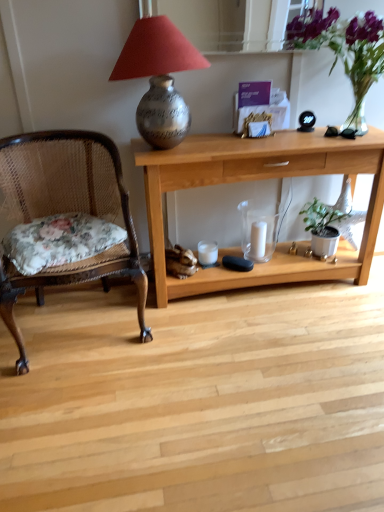
This screenshot has height=512, width=384. What do you see at coordinates (322, 227) in the screenshot?
I see `green matte plant at lower right` at bounding box center [322, 227].

Measure the distance between silver textured vase at upper center and camera.

The depth of silver textured vase at upper center is 4.97 feet.

What is the approximate height of transparent glass candle holder at center, the 1th candle holder in the right-to-left sequence?

transparent glass candle holder at center, the 1th candle holder in the right-to-left sequence, is 11.95 inches in height.

Measure the distance between point (48, 231) and camera.

Point (48, 231) and camera are 1.74 meters apart.

Identify the location of light wood desk at center. This screenshot has width=384, height=512. (257, 179).

Considering the positions of points (44, 204) and (261, 234), is point (44, 204) closer to camera compared to point (261, 234)?

That is True.

Is woven wood chair with floral cushion at left completely or partially outside of white matte candle at center?

woven wood chair with floral cushion at left lies outside white matte candle at center's area.

From the image's perspective, is woven wood chair with floral cushion at left located beneath white matte candle at center?

Yes, from the image's perspective, woven wood chair with floral cushion at left is below white matte candle at center.

Relative to white matte candle at center, is woven wood chair with floral cushion at left in front or behind?

Visually, woven wood chair with floral cushion at left is located in front of white matte candle at center.

Does green matte plant at lower right have a lesser height compared to white matte candle at center?

Incorrect, the height of green matte plant at lower right does not fall short of that of white matte candle at center.

Consider the image. Can you confirm if green matte plant at lower right is positioned to the right of white matte candle at center?

Indeed, green matte plant at lower right is positioned on the right side of white matte candle at center.

Considering the relative sizes of green matte plant at lower right and white matte candle at center in the image provided, is green matte plant at lower right bigger than white matte candle at center?

Yes, green matte plant at lower right is bigger than white matte candle at center.

Considering the relative sizes of white matte candle at center and transparent glass candle holder at center, the 1th candle holder in the right-to-left sequence, in the image provided, is white matte candle at center taller than transparent glass candle holder at center, the 1th candle holder in the right-to-left sequence,?

No, white matte candle at center is not taller than transparent glass candle holder at center, the 1th candle holder in the right-to-left sequence.

What's the angular difference between white matte candle at center and transparent glass candle holder at center, the 1th candle holder in the right-to-left sequence,'s facing directions?

They differ by 0.459 degrees in their facing directions.

Can you confirm if white matte candle at center is positioned to the left of transparent glass candle holder at center, which ranks as the 2th candle holder in left-to-right order?

In fact, white matte candle at center is to the right of transparent glass candle holder at center, which ranks as the 2th candle holder in left-to-right order.

From a real-world perspective, is white matte candle at center physically located above or below transparent glass candle holder at center, which ranks as the 2th candle holder in left-to-right order?

From a real-world perspective, white matte candle at center is physically below transparent glass candle holder at center, which ranks as the 2th candle holder in left-to-right order.

Which is in front, point (66, 184) or point (202, 149)?

The point (202, 149) is closer to the camera.

Is woven wood chair with floral cushion at left taller or shorter than light wood desk at center?

In the image, woven wood chair with floral cushion at left appears to be taller than light wood desk at center.

From a real-world perspective, who is located higher, woven wood chair with floral cushion at left or light wood desk at center?

From a 3D spatial view, woven wood chair with floral cushion at left is above.

Is white matte candle at center to the left or to the right of silver textured vase at upper center in the image?

white matte candle at center is positioned on silver textured vase at upper center's right side.

Is the depth of white matte candle at center less than that of silver textured vase at upper center?

No, white matte candle at center is further to the viewer.

Does white matte candle at center touch silver textured vase at upper center?

They are not placed beside each other.

Is white matte candle at center completely or partially outside of silver textured vase at upper center?

Indeed, white matte candle at center is completely outside silver textured vase at upper center.

Are transparent glass candle holder at center, which ranks as the 2th candle holder in left-to-right order, and white matte candle holder at center, which is counted as the 1th candle holder, starting from the left, beside each other?

There is a gap between transparent glass candle holder at center, which ranks as the 2th candle holder in left-to-right order, and white matte candle holder at center, which is counted as the 1th candle holder, starting from the left.

Which is more to the left, transparent glass candle holder at center, which ranks as the 2th candle holder in left-to-right order, or white matte candle holder at center, which appears as the 2th candle holder when viewed from the right?

Positioned to the left is white matte candle holder at center, which appears as the 2th candle holder when viewed from the right.

From a real-world perspective, which is physically below, transparent glass candle holder at center, which ranks as the 2th candle holder in left-to-right order, or white matte candle holder at center, which is counted as the 1th candle holder, starting from the left?

From a 3D spatial view, white matte candle holder at center, which is counted as the 1th candle holder, starting from the left, is below.

Is transparent glass candle holder at center, which ranks as the 2th candle holder in left-to-right order, bigger than white matte candle holder at center, which is counted as the 1th candle holder, starting from the left?

Correct, transparent glass candle holder at center, which ranks as the 2th candle holder in left-to-right order, is larger in size than white matte candle holder at center, which is counted as the 1th candle holder, starting from the left.

In the scene shown: Is purple glass vase at upper right taller than woven wood chair with floral cushion at left?

No.

Is the depth of purple glass vase at upper right less than that of woven wood chair with floral cushion at left?

No, purple glass vase at upper right is behind woven wood chair with floral cushion at left.

From the image's perspective, is purple glass vase at upper right on woven wood chair with floral cushion at left?

Indeed, from the image's perspective, purple glass vase at upper right is shown above woven wood chair with floral cushion at left.

Is purple glass vase at upper right facing away from woven wood chair with floral cushion at left?

purple glass vase at upper right is not turned away from woven wood chair with floral cushion at left.

Image resolution: width=384 pixels, height=512 pixels. What are the coordinates of `chair above the white matte candle at center (from a real-world perspective)` in the screenshot? It's located at (64, 220).

At what (x,y) coordinates should I click in order to perform the action: click on houseplant in front of the white matte candle at center. Please return your answer as a coordinate pair (x, y). Image resolution: width=384 pixels, height=512 pixels. Looking at the image, I should click on (322, 227).

Estimate the real-world distances between objects in this image. Which object is closer to white matte candle holder at center, which appears as the 2th candle holder when viewed from the right, purple glass vase at upper right or woven wood chair with floral cushion at left?

The object closer to white matte candle holder at center, which appears as the 2th candle holder when viewed from the right, is woven wood chair with floral cushion at left.

Estimate the real-world distances between objects in this image. Which object is further from white matte candle at center, silver textured vase at upper center or transparent glass candle holder at center, the 1th candle holder in the right-to-left sequence?

silver textured vase at upper center is further to white matte candle at center.

Which object lies further to the anchor point woven wood chair with floral cushion at left, green matte plant at lower right or light wood desk at center?

Based on the image, green matte plant at lower right appears to be further to woven wood chair with floral cushion at left.

Which object lies further to the anchor point purple glass vase at upper right, woven wood chair with floral cushion at left or silver textured vase at upper center?

woven wood chair with floral cushion at left lies further to purple glass vase at upper right than the other object.

When comparing their distances from light wood desk at center, does white matte candle holder at center, which appears as the 2th candle holder when viewed from the right, or green matte plant at lower right seem closer?

The object closer to light wood desk at center is green matte plant at lower right.

From the image, which object appears to be nearer to white matte candle at center, green matte plant at lower right or silver textured vase at upper center?

green matte plant at lower right is positioned closer to the anchor white matte candle at center.

Estimate the real-world distances between objects in this image. Which object is further from white matte candle holder at center, which appears as the 2th candle holder when viewed from the right, white matte candle at center or transparent glass candle holder at center, the 1th candle holder in the right-to-left sequence?

Among the two, white matte candle at center is located further to white matte candle holder at center, which appears as the 2th candle holder when viewed from the right.

Which object lies further to the anchor point light wood desk at center, green matte plant at lower right or white matte candle holder at center, which is counted as the 1th candle holder, starting from the left?

white matte candle holder at center, which is counted as the 1th candle holder, starting from the left, is further to light wood desk at center.

Find the location of `houseplant between silver textured vase at upper center and purple glass vase at upper right in the horizontal direction`. houseplant between silver textured vase at upper center and purple glass vase at upper right in the horizontal direction is located at coordinates (322, 227).

The width and height of the screenshot is (384, 512). I want to click on lamp between woven wood chair with floral cushion at left and transparent glass candle holder at center, the 1th candle holder in the right-to-left sequence, so click(x=159, y=78).

Find the location of `lamp located between woven wood chair with floral cushion at left and green matte plant at lower right in the left-right direction`. lamp located between woven wood chair with floral cushion at left and green matte plant at lower right in the left-right direction is located at coordinates (159, 78).

You are a GUI agent. You are given a task and a screenshot of the screen. Output one action in this format:
    pyautogui.click(x=<x>, y=<y>)
    Task: Click on the desk between purple glass vase at upper right and green matte plant at lower right from top to bottom
    Image resolution: width=384 pixels, height=512 pixels.
    Given the screenshot: What is the action you would take?
    pyautogui.click(x=257, y=179)